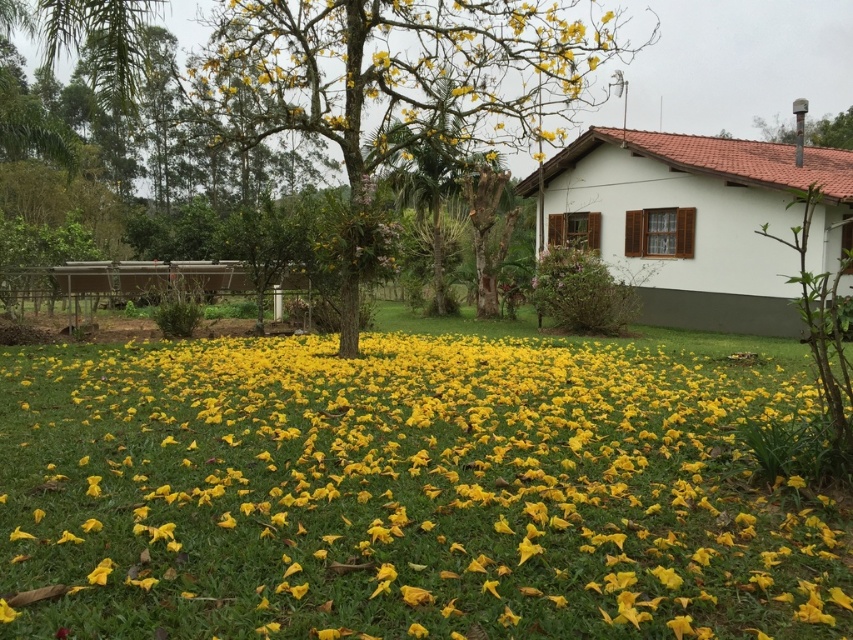
You are planning to place a new garden statue that is 1 meter tall in the center of the lawn. Considering the yellow matte flower at center and the yellow leafy tree at center, which object will the statue be taller than?

The yellow matte flower at center is smaller than the yellow leafy tree at center. Since the statue is 1 meter tall, it will be taller than the yellow matte flower at center if the flower is shorter than 1 meter. However, without specific measurements, we can only confirm that the statue will be taller than the flower because the flower is explicitly stated to be smaller than the tree. The tree might still be taller than the statue depending on its actual height.

You are standing at the point marked as point [399,72] in the image. What is the nearest object to you in the scene?

The nearest object to you is the yellow leafy tree at center because the point is located on it.

You are planning to place a small garden statue that is 1 meter wide in the center of the lawn. Given the yellow matte flower at center and the yellow leafy tree at center, which object is narrower and can the statue be placed without overlapping either?

The yellow matte flower at center is narrower than the yellow leafy tree at center. Since the statue is 1 meter wide, it can be placed in the center as long as the flower and tree combined do not exceed 1 meter in width. However, since the flower is narrower than the tree, but we don not know their exact widths, we cannot confirm if the statue will fit without overlapping. More information is needed.